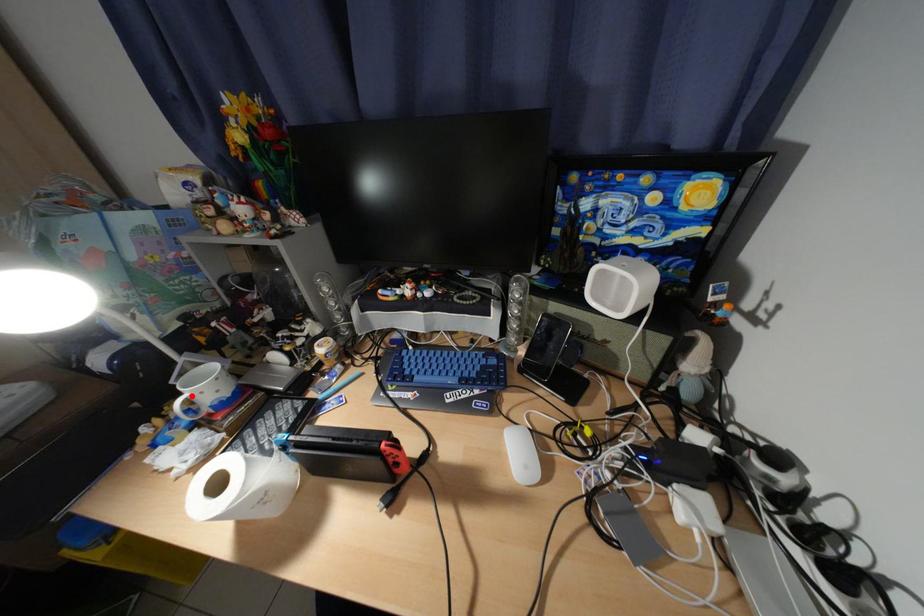
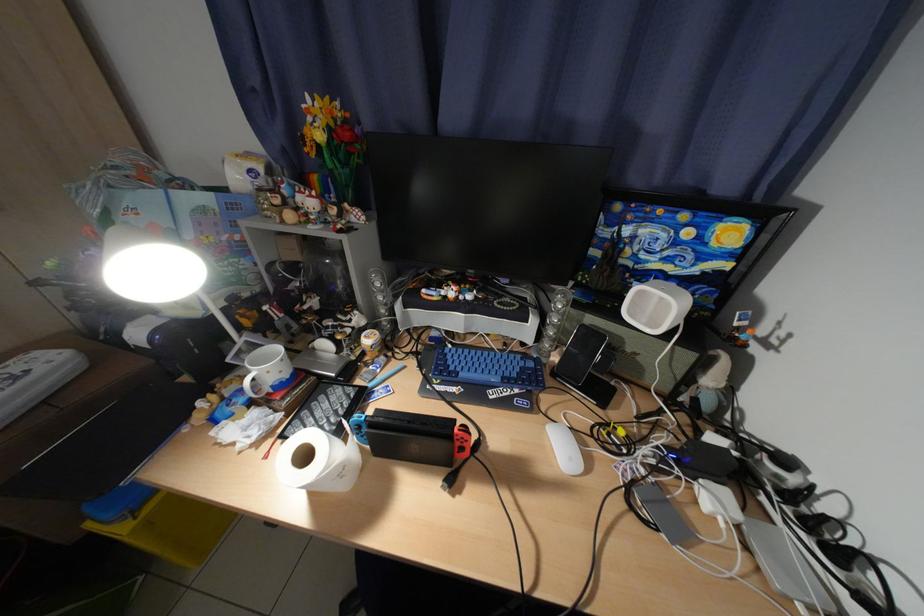
Where in the second image is the point corresponding to the highlighted location from the first image?

(260, 374)